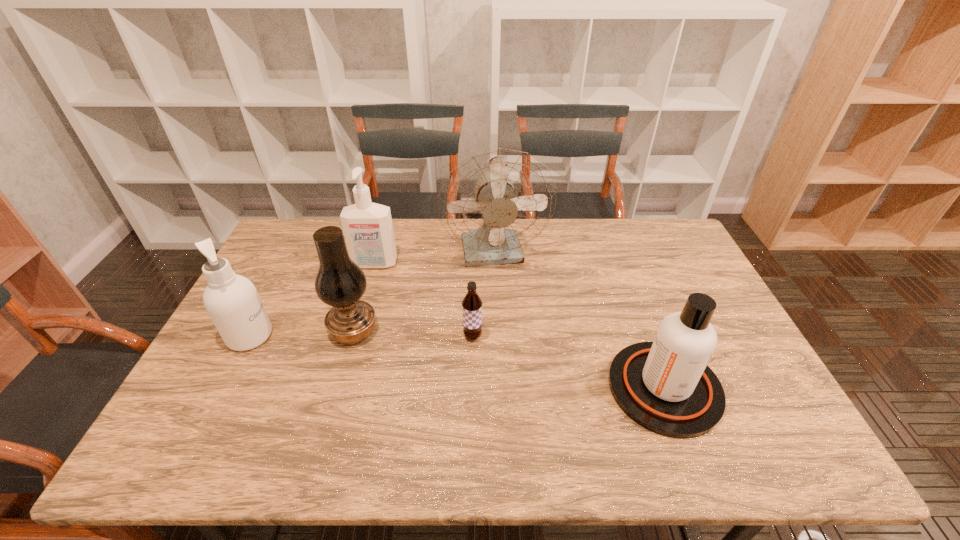
Where is `vacant space at the left edge of the desktop`? vacant space at the left edge of the desktop is located at coordinates (223, 353).

Locate an element on the screen. Image resolution: width=960 pixels, height=540 pixels. blank space at the right edge of the desktop is located at coordinates (656, 261).

Where is `blank space at the far right corner of the desktop`? blank space at the far right corner of the desktop is located at coordinates (638, 222).

I want to click on blank space at the near right corner of the desktop, so click(x=748, y=429).

This screenshot has height=540, width=960. In order to click on unoccupied area between the second cleansing agent from left to right and the leftmost cleansing agent in this screenshot , I will do `click(312, 300)`.

Find the location of a particular element. free space that is in between the fan and the farthest cleansing agent is located at coordinates (435, 259).

What are the coordinates of `vacant point located between the rightmost object and the tallest object` in the screenshot? It's located at (580, 321).

The width and height of the screenshot is (960, 540). Find the location of `empty space that is in between the root beer and the fan`. empty space that is in between the root beer and the fan is located at coordinates (484, 295).

Locate an element on the screen. Image resolution: width=960 pixels, height=540 pixels. empty space between the leftmost object and the tallest object is located at coordinates (372, 295).

Image resolution: width=960 pixels, height=540 pixels. I want to click on unoccupied position between the shortest object and the rightmost cleansing agent, so click(568, 362).